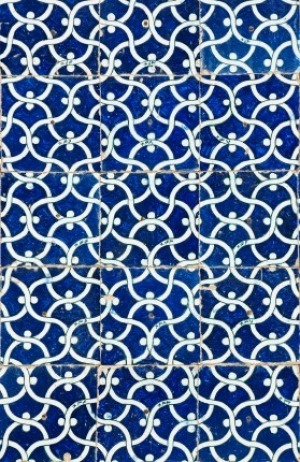
The width and height of the screenshot is (300, 462). Identify the location of bottom right tile. (247, 415).